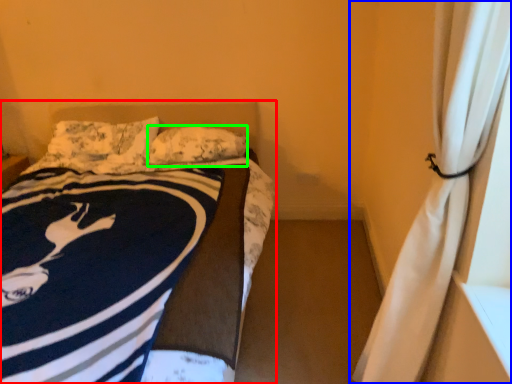
Question: Estimate the real-world distances between objects in this image. Which object is closer to bed (highlighted by a red box), curtain (highlighted by a blue box) or pillow (highlighted by a green box)?

Choices:
 (A) curtain
 (B) pillow

Answer: (B)